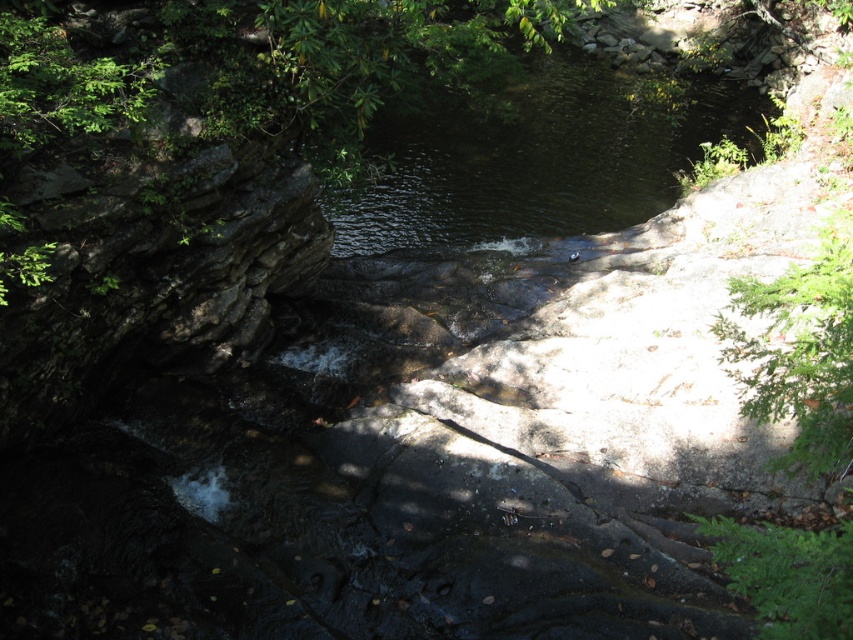
Question: Is green leafy tree at upper center below dark green water at center?

Choices:
 (A) no
 (B) yes

Answer: (A)

Question: Can you confirm if green leafy tree at upper center is positioned to the left of dark green water at center?

Choices:
 (A) no
 (B) yes

Answer: (B)

Question: Is green leafy tree at upper center to the right of dark green water at center from the viewer's perspective?

Choices:
 (A) yes
 (B) no

Answer: (B)

Question: Which object is farther from the camera taking this photo?

Choices:
 (A) dark green water at center
 (B) green leafy tree at upper center

Answer: (A)